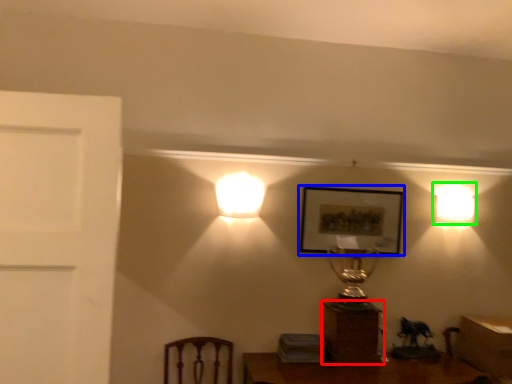
Question: Which object is positioned farthest from furniture (highlighted by a red box)? Select from picture frame (highlighted by a blue box) and lamp (highlighted by a green box).

Choices:
 (A) picture frame
 (B) lamp

Answer: (B)